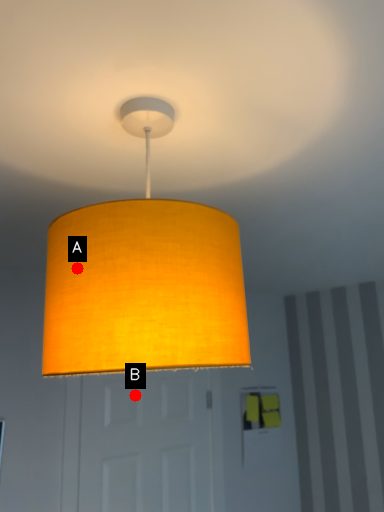
Question: Two points are circled on the image, labeled by A and B beside each circle. Among these points, which one is farthest from the camera?

Choices:
 (A) A is further
 (B) B is further

Answer: (B)